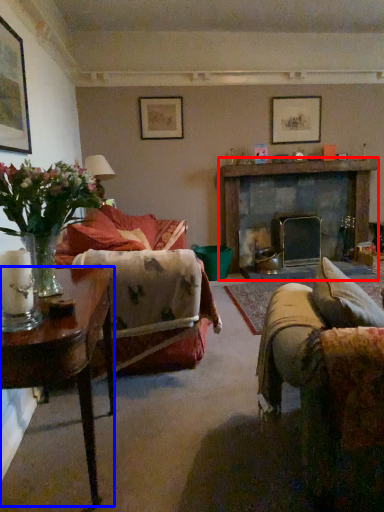
Question: Which object is further to the camera taking this photo, fireplace (highlighted by a red box) or table (highlighted by a blue box)?

Choices:
 (A) fireplace
 (B) table

Answer: (A)